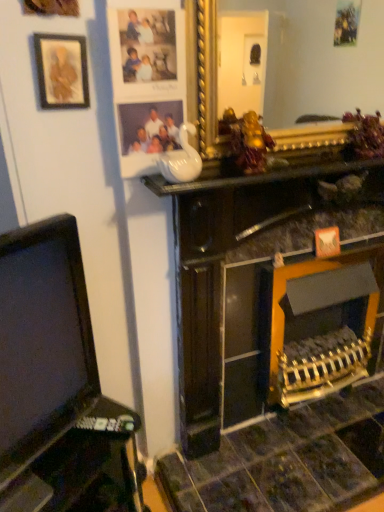
Question: Is black plastic tv at left positioned in front of matte plastic picture frame at upper center, which is the 2th picture frame from left to right?

Choices:
 (A) no
 (B) yes

Answer: (B)

Question: From the image's perspective, is black plastic tv at left above matte plastic picture frame at upper center, which is counted as the 1th picture frame, starting from the right?

Choices:
 (A) no
 (B) yes

Answer: (A)

Question: Is black plastic tv at left far from matte plastic picture frame at upper center, which is the 2th picture frame from left to right?

Choices:
 (A) yes
 (B) no

Answer: (B)

Question: From the image's perspective, would you say black plastic tv at left is shown under matte plastic picture frame at upper center, which is counted as the 1th picture frame, starting from the right?

Choices:
 (A) yes
 (B) no

Answer: (A)

Question: Is black plastic tv at left oriented away from matte plastic picture frame at upper center, which is counted as the 1th picture frame, starting from the right?

Choices:
 (A) no
 (B) yes

Answer: (A)

Question: Considering the positions of point (183, 139) and point (269, 176), is point (183, 139) closer or farther from the camera than point (269, 176)?

Choices:
 (A) closer
 (B) farther

Answer: (A)

Question: Choose the correct answer: Is matte plastic picture frame at upper center, which is the 2th picture frame from left to right, inside white glossy vase at upper center or outside it?

Choices:
 (A) outside
 (B) inside

Answer: (A)

Question: Based on their sizes in the image, would you say matte plastic picture frame at upper center, which is counted as the 1th picture frame, starting from the right, is bigger or smaller than white glossy vase at upper center?

Choices:
 (A) big
 (B) small

Answer: (B)

Question: From a real-world perspective, is matte plastic picture frame at upper center, which is counted as the 1th picture frame, starting from the right, physically located above or below white glossy vase at upper center?

Choices:
 (A) above
 (B) below

Answer: (A)

Question: Is white glossy vase at upper center taller or shorter than black plastic tv at left?

Choices:
 (A) short
 (B) tall

Answer: (A)

Question: Looking at their shapes, would you say white glossy vase at upper center is wider or thinner than black plastic tv at left?

Choices:
 (A) wide
 (B) thin

Answer: (B)

Question: From the image's perspective, is white glossy vase at upper center above or below black plastic tv at left?

Choices:
 (A) below
 (B) above

Answer: (B)

Question: Is white glossy vase at upper center in front of or behind black plastic tv at left in the image?

Choices:
 (A) front
 (B) behind

Answer: (B)

Question: Considering the positions of matte gold picture frame at upper left, which appears as the 2th picture frame when viewed from the right, and white glossy vase at upper center in the image, is matte gold picture frame at upper left, which appears as the 2th picture frame when viewed from the right, taller or shorter than white glossy vase at upper center?

Choices:
 (A) tall
 (B) short

Answer: (A)

Question: Looking at their shapes, would you say matte gold picture frame at upper left, the first picture frame viewed from the left, is wider or thinner than white glossy vase at upper center?

Choices:
 (A) thin
 (B) wide

Answer: (A)